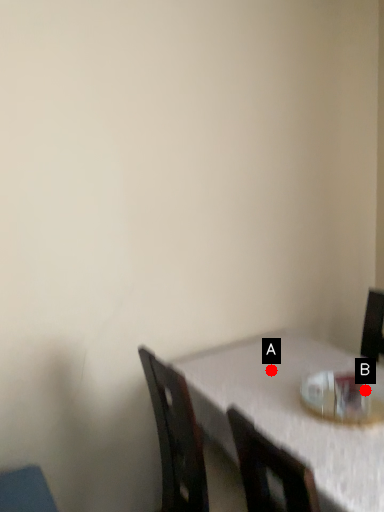
Question: Two points are circled on the image, labeled by A and B beside each circle. Which point is farther from the camera taking this photo?

Choices:
 (A) A is further
 (B) B is further

Answer: (A)